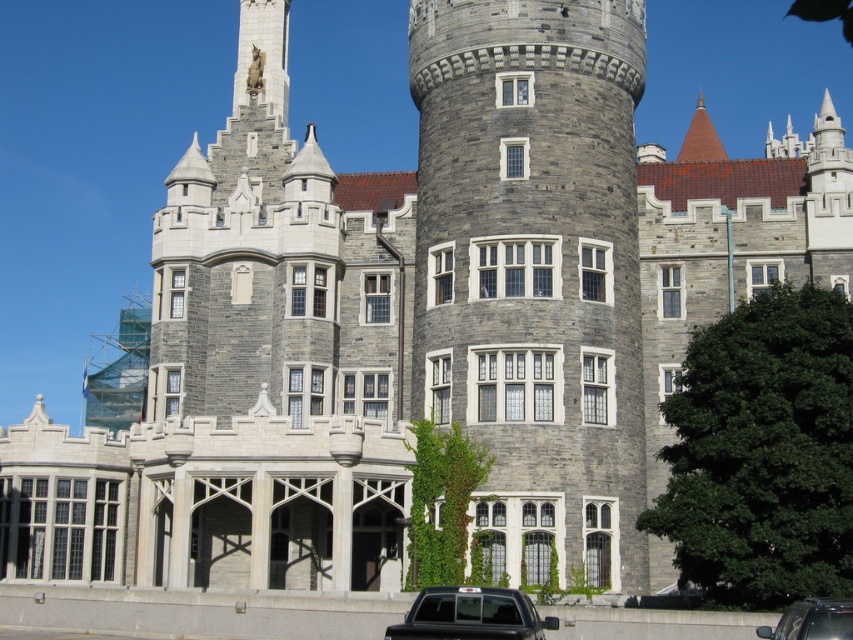
Question: In this image, where is black matte truck at lower center located relative to metallic silver car at lower right?

Choices:
 (A) left
 (B) right

Answer: (A)

Question: Which object is positioned closest to the black matte truck at lower center?

Choices:
 (A) gray stone tower at center
 (B) metallic silver car at lower right

Answer: (B)

Question: Which point is closer to the camera taking this photo?

Choices:
 (A) (845, 630)
 (B) (426, 616)
 (C) (585, 266)

Answer: (A)

Question: Can you confirm if black matte truck at lower center is positioned below metallic silver car at lower right?

Choices:
 (A) no
 (B) yes

Answer: (B)

Question: Which point appears closest to the camera in this image?

Choices:
 (A) 387,634
 (B) 820,620

Answer: (B)

Question: Can you confirm if gray stone tower at center is bigger than metallic silver car at lower right?

Choices:
 (A) no
 (B) yes

Answer: (B)